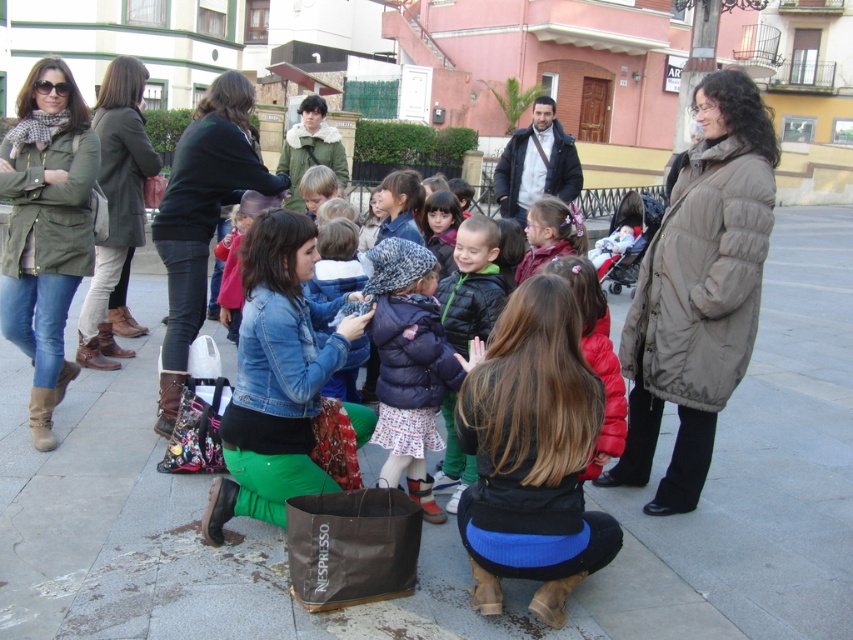
Question: Is dark gray suit at center above red puffer jacket at center?

Choices:
 (A) no
 (B) yes

Answer: (B)

Question: Is jeans at center to the left of dark blue puffer jacket at center from the viewer's perspective?

Choices:
 (A) yes
 (B) no

Answer: (A)

Question: Which of the following is the farthest from the observer?

Choices:
 (A) (622, 566)
 (B) (293, 134)
 (C) (572, 436)

Answer: (B)

Question: Which point is farther to the camera?

Choices:
 (A) green matte jacket at left
 (B) matte brown coat at center
 (C) dark gray suit at center
 (D) dark blue puffer jacket at center

Answer: (C)

Question: Which point appears farthest from the camera in this image?

Choices:
 (A) (85, 298)
 (B) (584, 563)
 (C) (170, 216)
 (D) (30, 284)

Answer: (A)

Question: Where is red puffer jacket at center located in relation to green fuzzy coat at center in the image?

Choices:
 (A) left
 (B) right

Answer: (B)